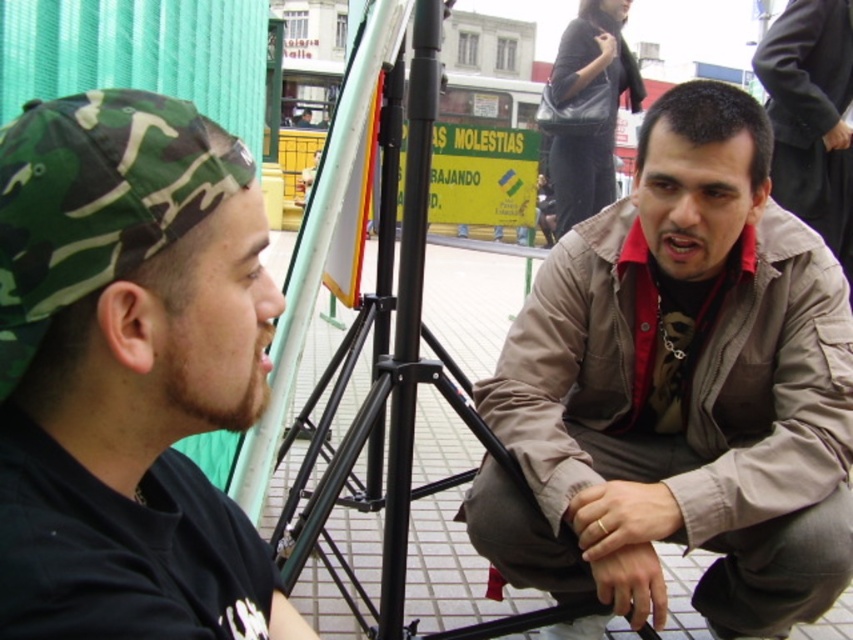
Question: Which object appears farthest from the camera in this image?

Choices:
 (A) brown leather jacket at center
 (B) black metal tripod at center
 (C) camouflage fabric cap at left
 (D) brown matte jacket at center

Answer: (A)

Question: From the image, what is the correct spatial relationship of camouflage fabric cap at left in relation to brown leather jacket at center?

Choices:
 (A) right
 (B) left

Answer: (B)

Question: Which is farther from the brown leather jacket at center?

Choices:
 (A) camouflage fabric cap at left
 (B) black metal tripod at center

Answer: (A)

Question: Does brown matte jacket at center have a lesser width compared to brown leather jacket at center?

Choices:
 (A) yes
 (B) no

Answer: (B)

Question: Does camouflage fabric cap at left have a smaller size compared to black metal tripod at center?

Choices:
 (A) yes
 (B) no

Answer: (A)

Question: Which object appears closest to the camera in this image?

Choices:
 (A) camouflage fabric cap at left
 (B) brown matte jacket at center
 (C) brown leather jacket at center
 (D) black metal tripod at center

Answer: (A)